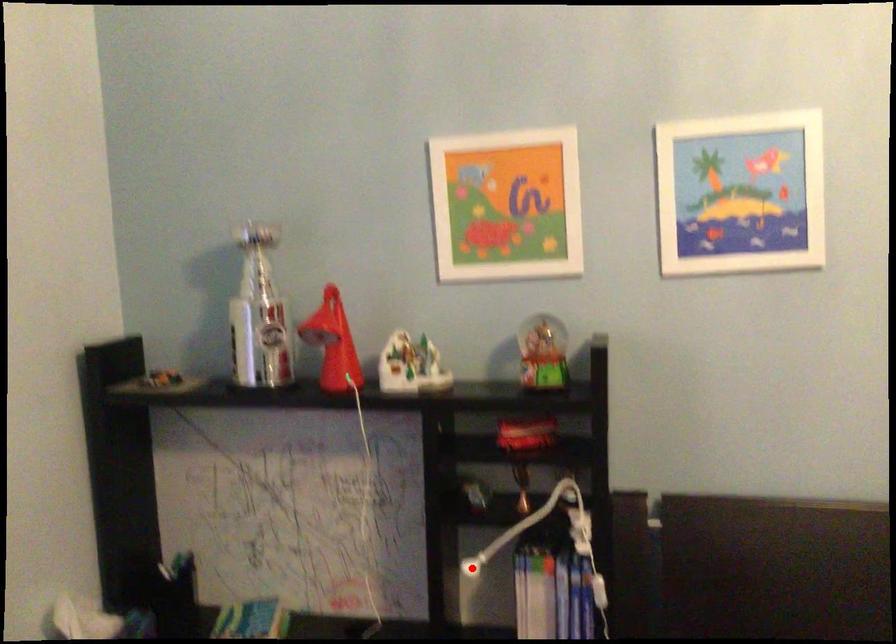
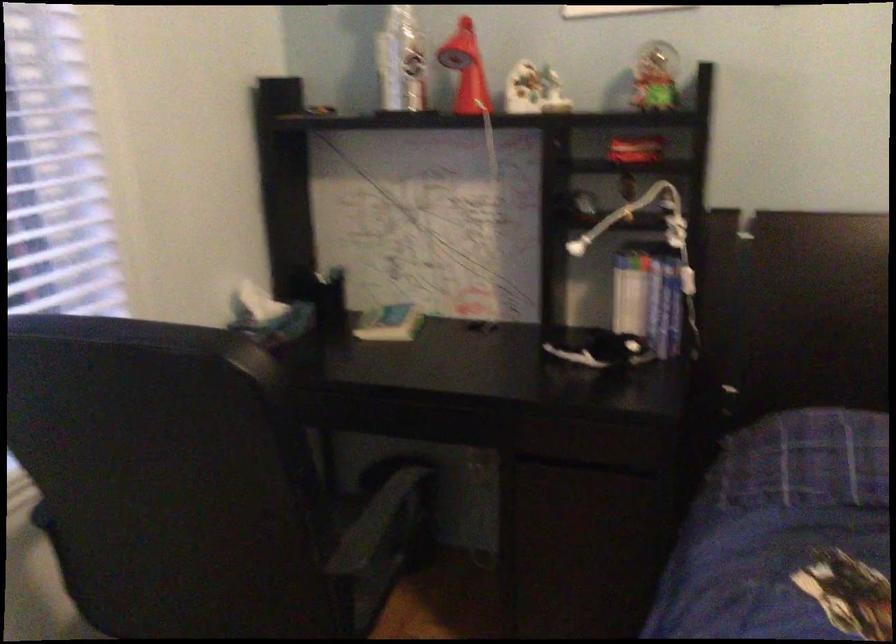
Question: I am providing you with two images of the same scene from different viewpoints. A red point is shown in image1. For the corresponding object point in image2, is it positioned nearer or farther from the camera?

Choices:
 (A) Nearer
 (B) Farther

Answer: (B)